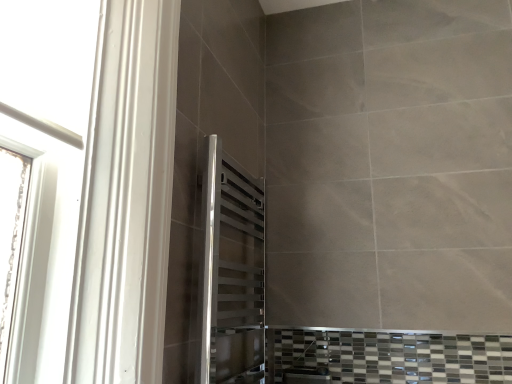
Question: Should I look upward or downward to see polished chrome towel rack at center?

Choices:
 (A) down
 (B) up

Answer: (A)